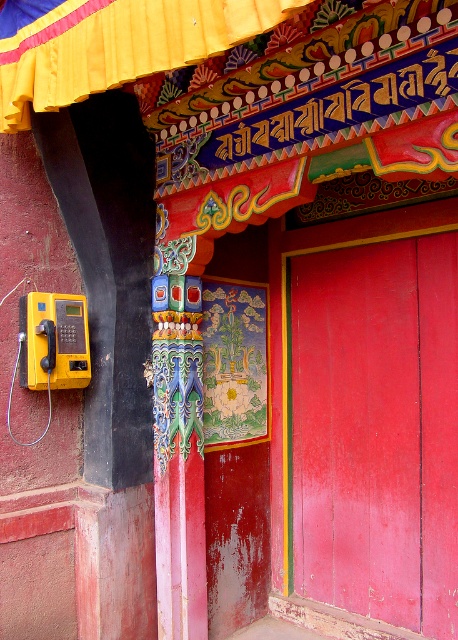
Between smooth glossy wood door at center and painted wood pillar at center, which one is positioned higher?

smooth glossy wood door at center

Where is `smooth glossy wood door at center`? smooth glossy wood door at center is located at coordinates (376, 429).

Between smooth glossy wood door at center and yellow plastic phone at left, which one has less height?

With less height is yellow plastic phone at left.

Consider the image. Who is higher up, smooth glossy wood door at center or yellow plastic phone at left?

Positioned higher is yellow plastic phone at left.

Find the location of a particular element. The width and height of the screenshot is (458, 640). smooth glossy wood door at center is located at coordinates (376, 429).

The image size is (458, 640). Identify the location of smooth glossy wood door at center. (376, 429).

Can you confirm if painted wood pillar at center is taller than yellow plastic phone at left?

Correct, painted wood pillar at center is much taller as yellow plastic phone at left.

The height and width of the screenshot is (640, 458). Find the location of `painted wood pillar at center`. painted wood pillar at center is located at coordinates (179, 445).

Who is more distant from viewer, (156, 275) or (43, 305)?

Point (156, 275)

Where is `painted wood pillar at center`? The height and width of the screenshot is (640, 458). painted wood pillar at center is located at coordinates (179, 445).